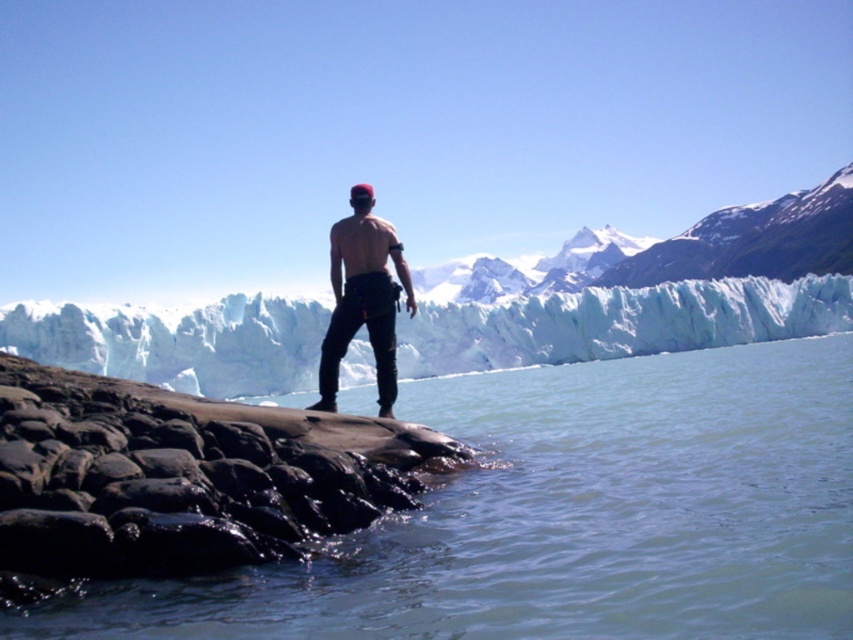
Question: Which object appears closest to the camera in this image?

Choices:
 (A) clear water at lower center
 (B) white ice glacier at center
 (C) smooth dark rock at lower left

Answer: (A)

Question: Which object is positioned farthest from the white ice glacier at center?

Choices:
 (A) clear water at lower center
 (B) smooth dark rock at lower left

Answer: (B)

Question: Which object is positioned closest to the clear water at lower center?

Choices:
 (A) smooth dark rock at lower left
 (B) white ice glacier at center

Answer: (A)

Question: Is clear water at lower center to the left of smooth dark rock at lower left from the viewer's perspective?

Choices:
 (A) no
 (B) yes

Answer: (A)

Question: Can you confirm if smooth dark rock at lower left is positioned to the right of white ice glacier at center?

Choices:
 (A) yes
 (B) no

Answer: (B)

Question: In this image, where is clear water at lower center located relative to white ice glacier at center?

Choices:
 (A) right
 (B) left

Answer: (B)